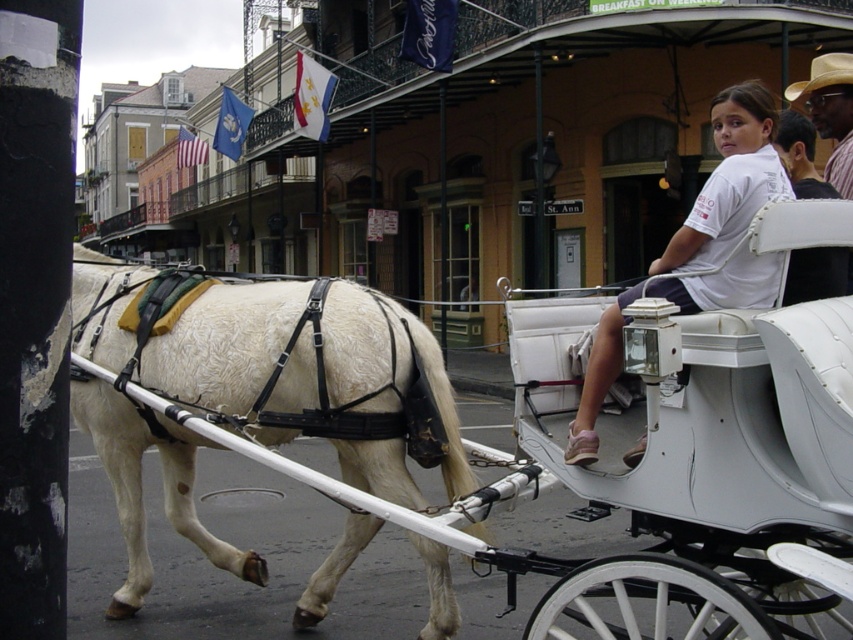
Based on the coordinates provided, where is the white textured horse at left positioned in the image?

The white textured horse at left is positioned at coordinates point [225,342].

You are a tourist in New Orleans and spot a historic horse carriage ride. You notice two items at the upper right of the scene. Which item is located lower between the white cotton shirt at upper right and the tan straw hat at upper right?

The white cotton shirt at upper right is positioned under the tan straw hat at upper right, so the white cotton shirt at upper right is lower.